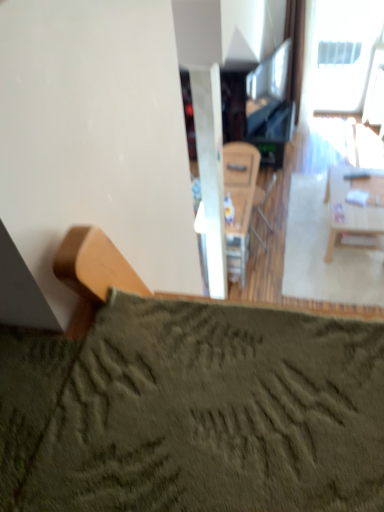
Find the location of a particular element. Image resolution: width=384 pixels, height=512 pixels. wooden armchair at center is located at coordinates (263, 200).

Identify the location of white plastic window at upper right. (344, 52).

You are a GUI agent. You are given a task and a screenshot of the screen. Output one action in this format:
    pyautogui.click(x=<x>, y=<y>)
    Task: Click on the wooden armchair at center
    Image resolution: width=384 pixels, height=512 pixels.
    Given the screenshot: What is the action you would take?
    pyautogui.click(x=263, y=200)

Considering the sizes of objects wooden armchair at center and light wood table at right in the image provided, who is smaller, wooden armchair at center or light wood table at right?

wooden armchair at center is smaller.

Is wooden armchair at center far away from light wood table at right?

No, there isn't a large distance between wooden armchair at center and light wood table at right.

Is wooden armchair at center closer to the viewer compared to light wood table at right?

That is False.

From the image's perspective, who appears lower, white plastic window at upper right or wooden armchair at center?

wooden armchair at center appears lower in the image.

Is white plastic window at upper right to the left or to the right of wooden armchair at center in the image?

white plastic window at upper right is positioned on wooden armchair at center's right side.

Is white plastic window at upper right oriented away from wooden armchair at center?

white plastic window at upper right is not turned away from wooden armchair at center.

There is a light wood table at right. Where is `window above it (from a real-world perspective)`? window above it (from a real-world perspective) is located at coordinates (344, 52).

From a real-world perspective, is light wood table at right on white plastic window at upper right?

Actually, light wood table at right is physically below white plastic window at upper right in the real world.

Between light wood table at right and white plastic window at upper right, which one has smaller width?

With smaller width is white plastic window at upper right.

Based on the photo, from the image's perspective, which one is positioned higher, light wood table at right or white plastic window at upper right?

white plastic window at upper right is shown above in the image.

From the picture: Which is in front, wooden armchair at center or white plastic window at upper right?

wooden armchair at center is more forward.

Is wooden armchair at center facing away from white plastic window at upper right?

No, wooden armchair at center is not facing away from white plastic window at upper right.

You are a GUI agent. You are given a task and a screenshot of the screen. Output one action in this format:
    pyautogui.click(x=<x>, y=<y>)
    Task: Click on the armchair that appears on the left of white plastic window at upper right
    
    Given the screenshot: What is the action you would take?
    pyautogui.click(x=263, y=200)

Is wooden armchair at center not inside white plastic window at upper right?

Yes, wooden armchair at center is not within white plastic window at upper right.

In the image, is white plastic window at upper right positioned in front of or behind light wood table at right?

Clearly, white plastic window at upper right is behind light wood table at right.

Could you tell me if white plastic window at upper right is turned towards light wood table at right?

Yes, white plastic window at upper right is aimed at light wood table at right.

Locate an element on the screen. The height and width of the screenshot is (512, 384). window behind the light wood table at right is located at coordinates (344, 52).

Are white plastic window at upper right and light wood table at right located far from each other?

Indeed, white plastic window at upper right is not near light wood table at right.

Would you consider light wood table at right to be distant from wooden armchair at center?

That's not correct — light wood table at right is a little close to wooden armchair at center.

Is light wood table at right positioned behind wooden armchair at center?

No, light wood table at right is closer to the viewer.

Considering the relative sizes of light wood table at right and wooden armchair at center in the image provided, is light wood table at right thinner than wooden armchair at center?

No, light wood table at right is not thinner than wooden armchair at center.

Can you confirm if light wood table at right is positioned to the left of wooden armchair at center?

No.

Locate an element on the screen. armchair lying above the light wood table at right (from the image's perspective) is located at coordinates (263, 200).

The image size is (384, 512). Find the location of `window positioned vertically above the wooden armchair at center (from a real-world perspective)`. window positioned vertically above the wooden armchair at center (from a real-world perspective) is located at coordinates (344, 52).

Looking at the image, which one is located closer to wooden armchair at center, light wood table at right or white plastic window at upper right?

Among the two, light wood table at right is located nearer to wooden armchair at center.

In the scene shown: When comparing their distances from light wood table at right, does white plastic window at upper right or wooden armchair at center seem closer?

wooden armchair at center lies closer to light wood table at right than the other object.

Considering their positions, is wooden armchair at center positioned further to light wood table at right than white plastic window at upper right?

white plastic window at upper right is further to light wood table at right.

When comparing their distances from white plastic window at upper right, does wooden armchair at center or light wood table at right seem closer?

The object closer to white plastic window at upper right is wooden armchair at center.

Estimate the real-world distances between objects in this image. Which object is further from wooden armchair at center, white plastic window at upper right or light wood table at right?

white plastic window at upper right.

Considering their positions, is light wood table at right positioned closer to white plastic window at upper right than wooden armchair at center?

wooden armchair at center.

Where is `armchair between white plastic window at upper right and light wood table at right vertically`? armchair between white plastic window at upper right and light wood table at right vertically is located at coordinates (263, 200).